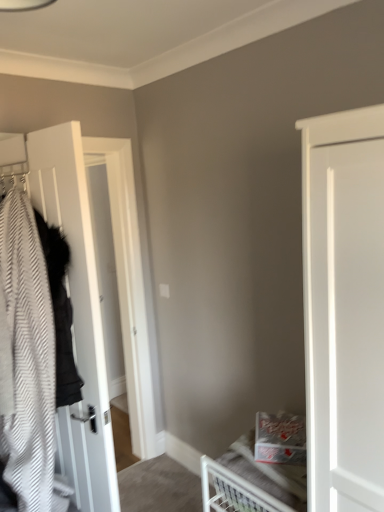
Question: From a real-world perspective, is white wood door at left physically located above or below white metal bed at lower right?

Choices:
 (A) above
 (B) below

Answer: (A)

Question: Considering the positions of white wood door at left and white metal bed at lower right in the image, is white wood door at left wider or thinner than white metal bed at lower right?

Choices:
 (A) wide
 (B) thin

Answer: (B)

Question: Is white wood door at left to the left or to the right of white metal bed at lower right in the image?

Choices:
 (A) left
 (B) right

Answer: (A)

Question: From a real-world perspective, is white metal bed at lower right above or below white wood door at left?

Choices:
 (A) above
 (B) below

Answer: (B)

Question: Is white metal bed at lower right taller or shorter than white wood door at left?

Choices:
 (A) short
 (B) tall

Answer: (A)

Question: Relative to white wood door at left, is white metal bed at lower right in front or behind?

Choices:
 (A) behind
 (B) front

Answer: (B)

Question: From the image's perspective, relative to white wood door at left, is white metal bed at lower right above or below?

Choices:
 (A) below
 (B) above

Answer: (A)